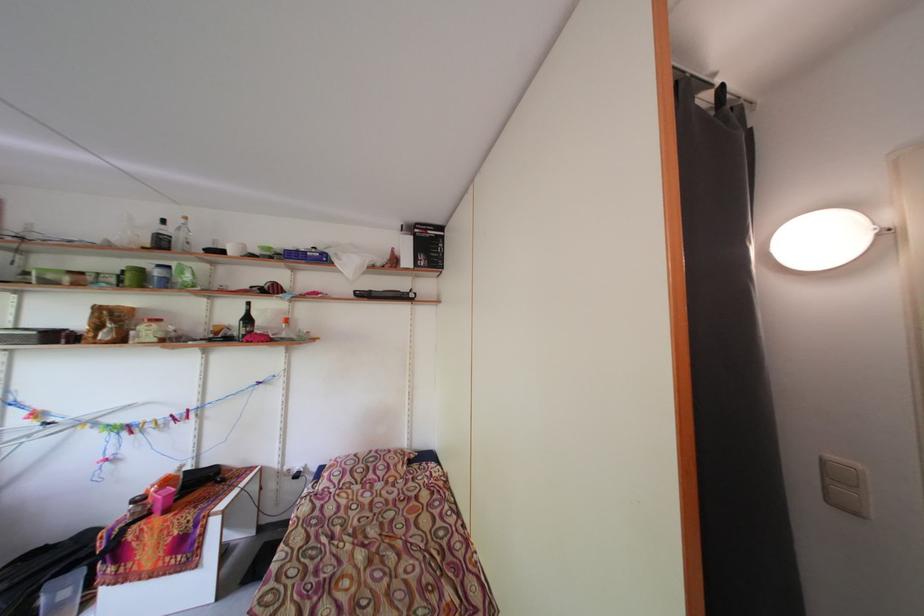
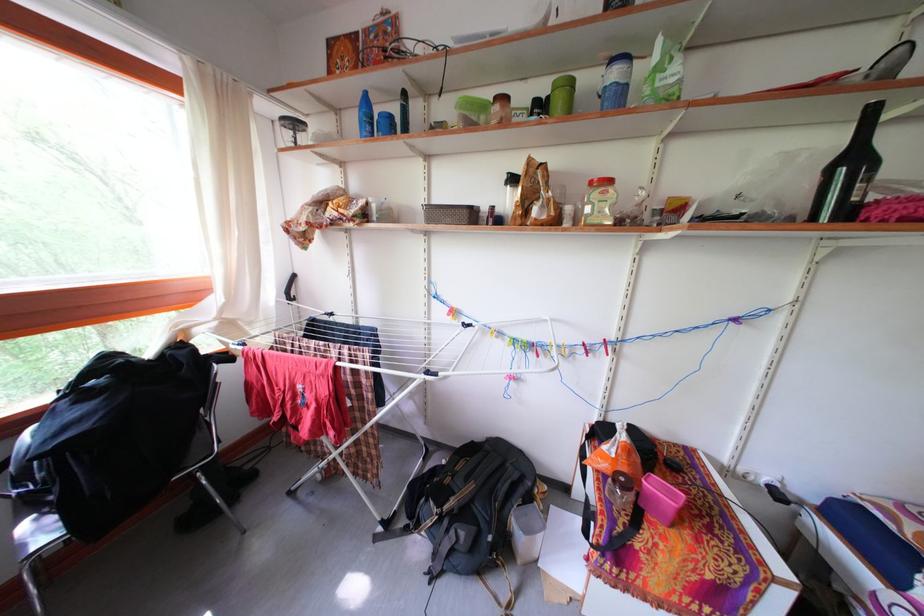
In the second image, find the point that corresponds to (x=132, y=440) in the first image.

(540, 361)